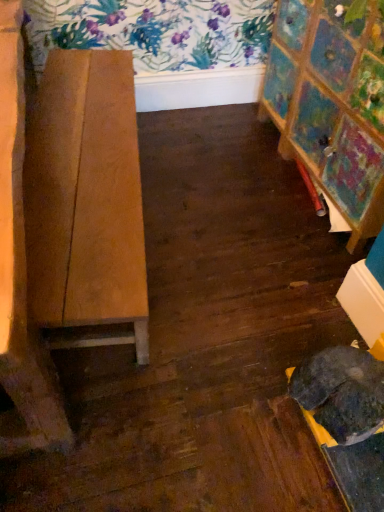
What is the approximate height of wooden table at left?

wooden table at left is 19.23 inches tall.

The height and width of the screenshot is (512, 384). What are the coordinates of `wooden table at left` in the screenshot? It's located at (86, 196).

Describe the element at coordinates (86, 196) in the screenshot. The height and width of the screenshot is (512, 384). I see `wooden table at left` at that location.

What do you see at coordinates (332, 102) in the screenshot?
I see `painted wood easel at right` at bounding box center [332, 102].

At what (x,y) coordinates should I click in order to perform the action: click on painted wood easel at right. Please return your answer as a coordinate pair (x, y). The width and height of the screenshot is (384, 512). Looking at the image, I should click on (332, 102).

This screenshot has width=384, height=512. Identify the location of wooden table at left. (86, 196).

Which object is positioned more to the left, painted wood easel at right or wooden table at left?

wooden table at left is more to the left.

Which object is further away from the camera taking this photo, painted wood easel at right or wooden table at left?

painted wood easel at right is further away from the camera.

Does point (355, 52) appear closer or farther from the camera than point (32, 205)?

Point (355, 52) appears to be farther away from the viewer than point (32, 205).

From the image's perspective, is painted wood easel at right above or below wooden table at left?

Based on their image positions, painted wood easel at right is located above wooden table at left.

From a real-world perspective, between painted wood easel at right and wooden table at left, who is vertically lower?

In real-world perspective, wooden table at left is lower.

Is painted wood easel at right wider than wooden table at left?

No, painted wood easel at right is not wider than wooden table at left.

Considering the relative sizes of painted wood easel at right and wooden table at left in the image provided, is painted wood easel at right shorter than wooden table at left?

No.

Considering the sizes of objects painted wood easel at right and wooden table at left in the image provided, who is bigger, painted wood easel at right or wooden table at left?

wooden table at left is bigger.

Can we say painted wood easel at right lies outside wooden table at left?

painted wood easel at right lies outside wooden table at left's area.

Is painted wood easel at right far away from wooden table at left?

Yes, painted wood easel at right and wooden table at left are quite far apart.

Could you tell me if painted wood easel at right is turned towards wooden table at left?

Yes, painted wood easel at right is facing wooden table at left.

How many degrees apart are the facing directions of painted wood easel at right and wooden table at left?

They differ by 6.35 degrees in their facing directions.

Where is `furniture located above the wooden table at left (from a real-world perspective)`? The height and width of the screenshot is (512, 384). furniture located above the wooden table at left (from a real-world perspective) is located at coordinates (332, 102).

Which is more to the right, wooden table at left or painted wood easel at right?

Positioned to the right is painted wood easel at right.

Relative to painted wood easel at right, is wooden table at left in front or behind?

wooden table at left is positioned closer to the viewer than painted wood easel at right.

Does point (38, 182) lie behind point (376, 139)?

No, it is in front of (376, 139).

From the image's perspective, is wooden table at left on top of painted wood easel at right?

No, from the image's perspective, wooden table at left is not on top of painted wood easel at right.

From a real-world perspective, relative to painted wood easel at right, is wooden table at left vertically above or below?

In terms of real-world spatial position, wooden table at left is below painted wood easel at right.

Which of these two, wooden table at left or painted wood easel at right, is wider?

wooden table at left is wider.

Who is taller, wooden table at left or painted wood easel at right?

painted wood easel at right.

Considering the sizes of objects wooden table at left and painted wood easel at right in the image provided, who is bigger, wooden table at left or painted wood easel at right?

Bigger between the two is wooden table at left.

Would you say painted wood easel at right is part of wooden table at left's contents?

No, painted wood easel at right is not a part of wooden table at left.

Are wooden table at left and painted wood easel at right beside each other?

wooden table at left and painted wood easel at right are not in contact.

Is wooden table at left facing towards painted wood easel at right?

No, wooden table at left is not aimed at painted wood easel at right.

How many degrees apart are the facing directions of wooden table at left and painted wood easel at right?

6.35 degrees.

How much distance is there between wooden table at left and painted wood easel at right?

wooden table at left is 1.00 meters from painted wood easel at right.

Locate an element on the screen. The height and width of the screenshot is (512, 384). furniture lying behind the wooden table at left is located at coordinates (332, 102).

I want to click on table below the painted wood easel at right (from a real-world perspective), so click(x=86, y=196).

Find the location of a particular element. This screenshot has height=512, width=384. furniture behind the wooden table at left is located at coordinates (332, 102).